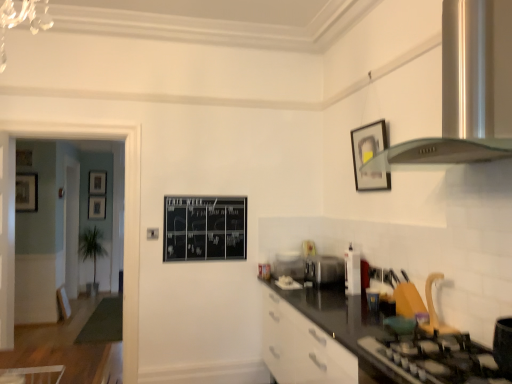
This screenshot has height=384, width=512. What are the coordinates of `free region under black chalkboard at center (from a real-world perspective)` in the screenshot? It's located at (204, 359).